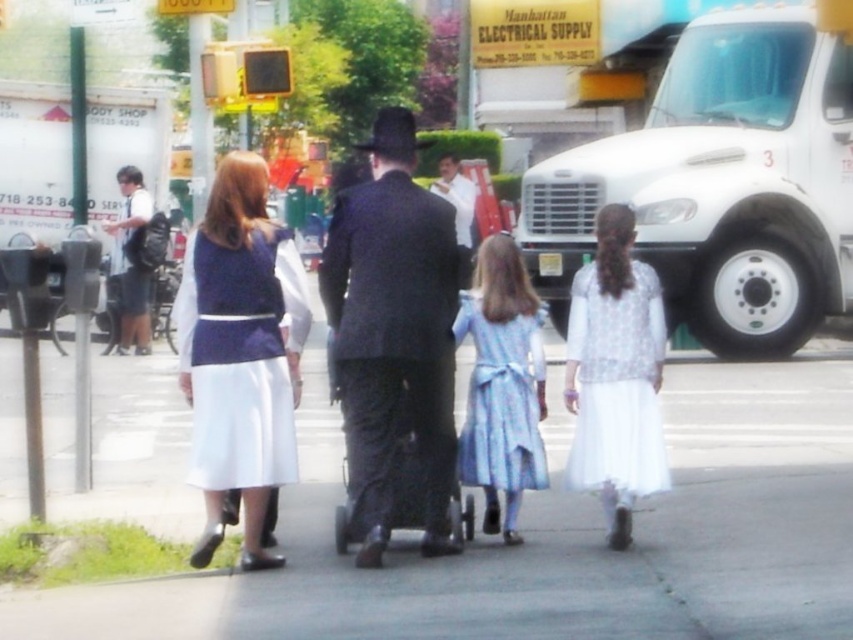
You are a delivery person who needs to park your delivery van on the gray concrete pavement at center. However, there is a white matte truck at right already parked there. Can you fit your van on the remaining space?

The gray concrete pavement at center is larger in size than the white matte truck at right, so there should be enough space remaining for your delivery van after the truck is parked.

In the scene, there are two people wearing white satin dress at center and white cotton shirt at center. Which one is positioned to the left?

The white satin dress at center is positioned to the left of the white cotton shirt at center.

You are a photographer trying to capture a clear photo of the white satin dress at center and the light blue satin dress at center. Since both dresses are in the same area, which one would appear closer to the camera in the final photo?

The white satin dress at center appears closer to the camera because it is in front of the light blue satin dress at center.